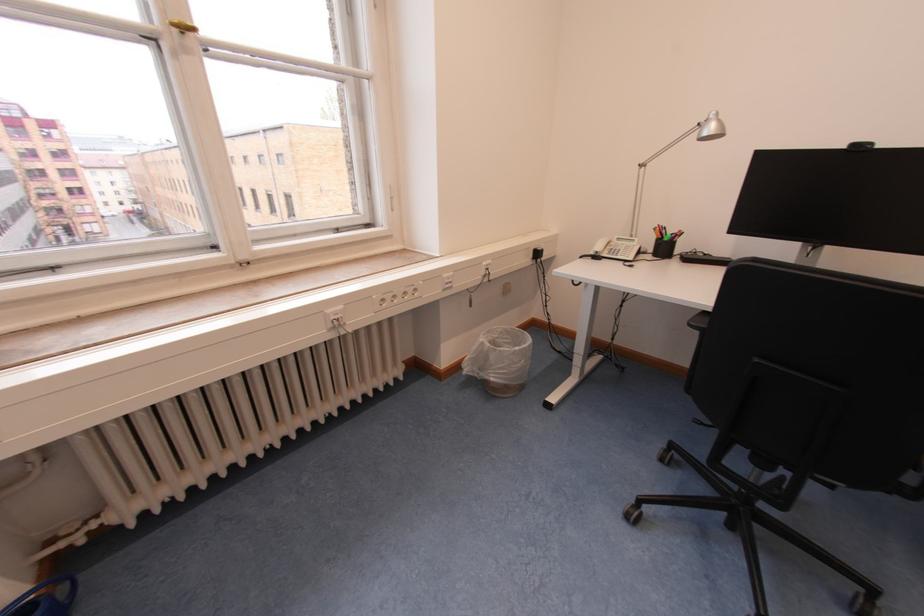
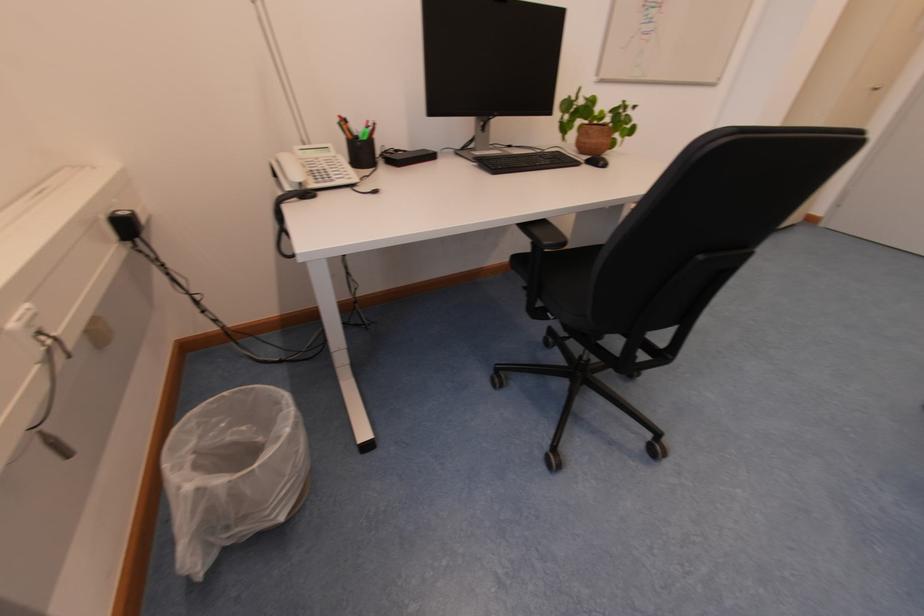
Question: I am providing you with two images of the same scene from different viewpoints. After the viewpoint changes to image2, which objects are now occluded?

Choices:
 (A) brown plant pot
 (B) computer mouse
 (C) chair sitting surface
 (D) none of these

Answer: (D)